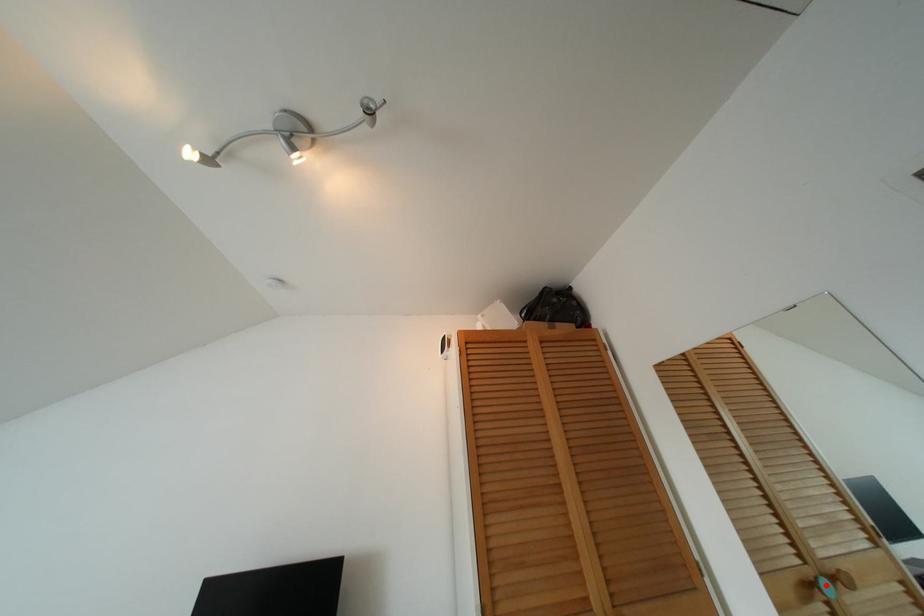
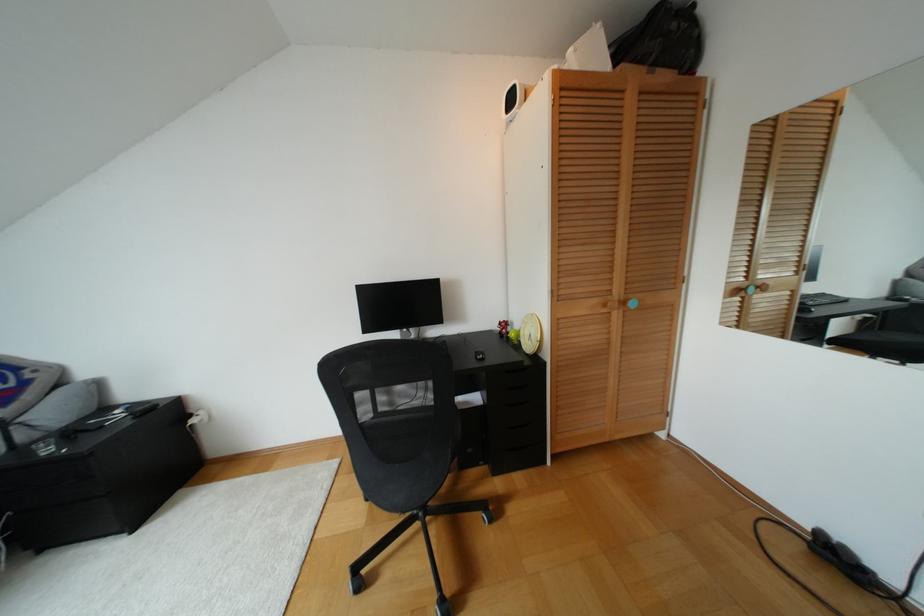
In the second image, find the point that corresponds to the highlighted location in the first image.

(750, 288)